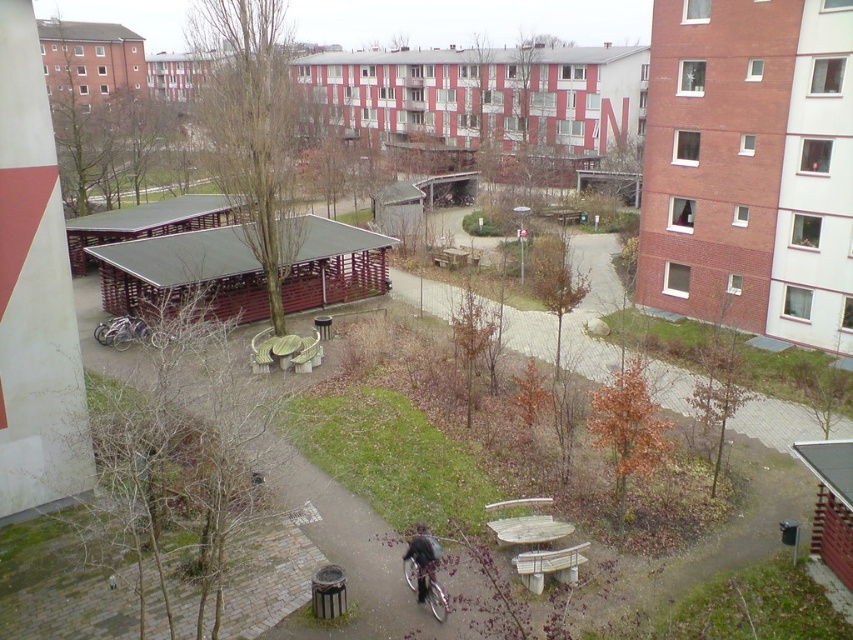
Which of these two, brick paved path at center or wooden picnic table at center, stands taller?

brick paved path at center

Is brick paved path at center positioned in front of wooden picnic table at center?

No.

Between point (426, 285) and point (535, 499), which one is positioned behind?

The point (426, 285) is more distant.

The height and width of the screenshot is (640, 853). Find the location of `brick paved path at center`. brick paved path at center is located at coordinates [x=776, y=422].

Can you confirm if dark gray fabric jacket at lower center is positioned to the right of silver metallic bicycle at center?

Indeed, dark gray fabric jacket at lower center is positioned on the right side of silver metallic bicycle at center.

Where is `dark gray fabric jacket at lower center`? Image resolution: width=853 pixels, height=640 pixels. dark gray fabric jacket at lower center is located at coordinates (422, 561).

Where is `dark gray fabric jacket at lower center`? The height and width of the screenshot is (640, 853). dark gray fabric jacket at lower center is located at coordinates (422, 561).

Does point (770, 403) come in front of point (431, 564)?

No, (770, 403) is further to viewer.

Who is more forward, [579,320] or [431,588]?

Point [431,588] is in front.

Find the location of a particular element. This screenshot has height=640, width=853. brick paved path at center is located at coordinates (776, 422).